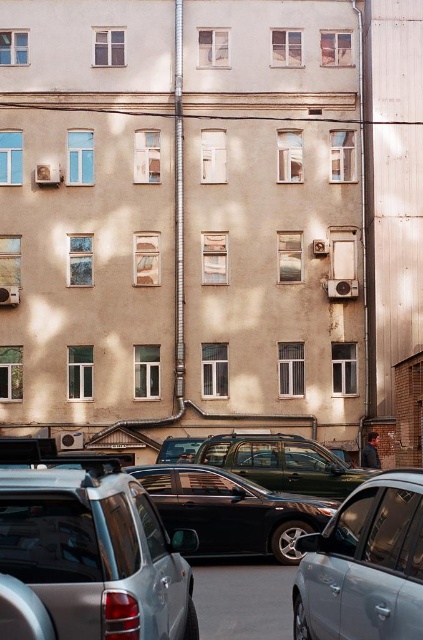
You are a delivery person who needs to park your vehicle in the parking area in front of the residential building. You see a satin silver car at center and a black plastic license plate at center. Which object is positioned to the right side of the parking area?

The black plastic license plate at center is positioned to the right side of the parking area because the satin silver car at center is to the left of it.

You are a delivery person trying to park your van in the parking area in front of the beige residential building. You see a satin silver car at center and a metallic green suv at center. Which vehicle should you avoid to ensure your van can fit in the parking spot next to them?

You should avoid the satin silver car at center because it has a larger size compared to the metallic green suv at center, so the parking spot next to the satin silver car at center may not accommodate your van due to limited space.